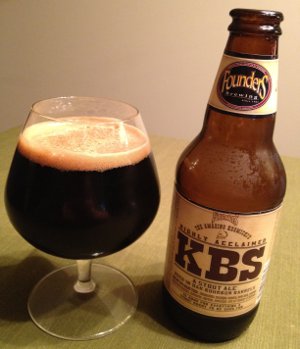
Locate an element on the screen. Image resolution: width=300 pixels, height=349 pixels. bottle is located at coordinates (239, 190).